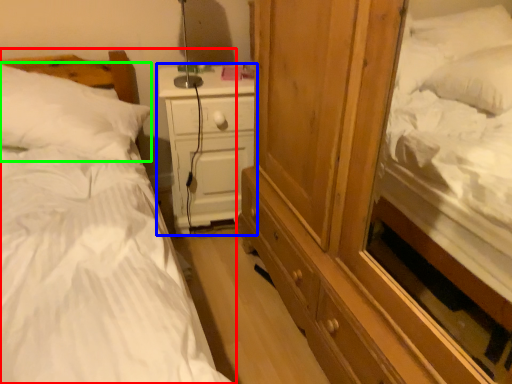
Question: Which object is positioned farthest from bed (highlighted by a red box)? Select from nightstand (highlighted by a blue box) and pillow (highlighted by a green box).

Choices:
 (A) nightstand
 (B) pillow

Answer: (A)